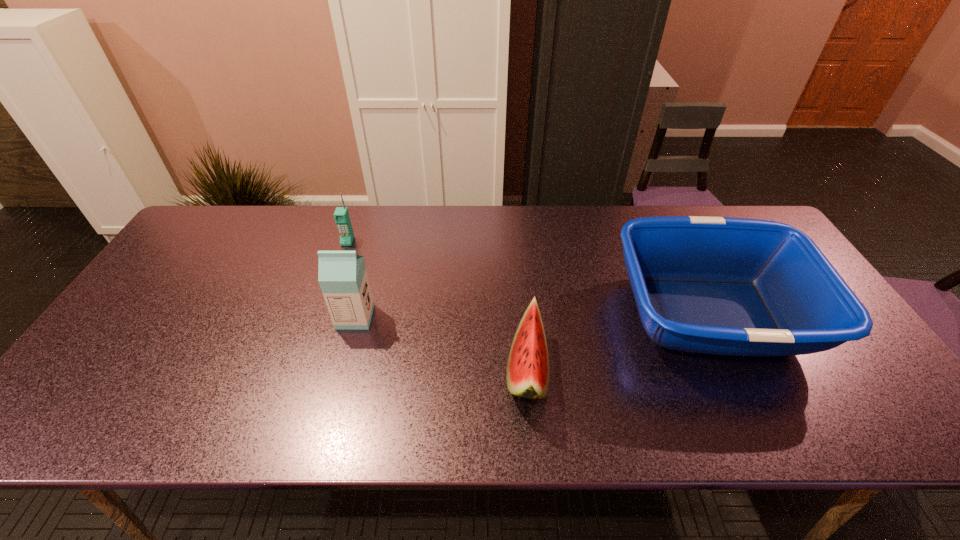
The width and height of the screenshot is (960, 540). Find the location of `vacant space that satisfies the following two spatial constraints: 1. on the keypad of the leftmost object; 2. on the right side of the rightmost object`. vacant space that satisfies the following two spatial constraints: 1. on the keypad of the leftmost object; 2. on the right side of the rightmost object is located at coordinates (324, 314).

I want to click on free region that satisfies the following two spatial constraints: 1. on the back side of the tallest object; 2. on the left side of the rightmost object, so click(x=356, y=314).

Where is `vacant space that satisfies the following two spatial constraints: 1. on the keypad of the farthest object; 2. on the left side of the rightmost object`? Image resolution: width=960 pixels, height=540 pixels. vacant space that satisfies the following two spatial constraints: 1. on the keypad of the farthest object; 2. on the left side of the rightmost object is located at coordinates (324, 314).

This screenshot has width=960, height=540. I want to click on free space that satisfies the following two spatial constraints: 1. on the keypad of the farthest object; 2. on the left side of the rightmost object, so click(x=324, y=314).

The height and width of the screenshot is (540, 960). What are the coordinates of `vacant space that satisfies the following two spatial constraints: 1. on the keypad of the third object from right to left; 2. on the left side of the farthest object` in the screenshot? It's located at (323, 316).

Identify the location of vacant space that satisfies the following two spatial constraints: 1. on the keypad of the tray; 2. on the right side of the cellular telephone. (324, 314).